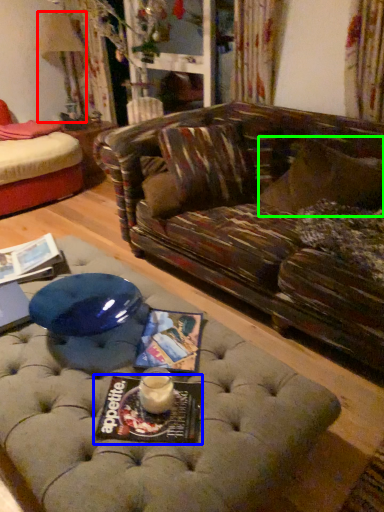
Question: Based on their relative distances, which object is farther from lamp (highlighted by a red box)? Choose from magazine (highlighted by a blue box) and pillow (highlighted by a green box).

Choices:
 (A) magazine
 (B) pillow

Answer: (A)